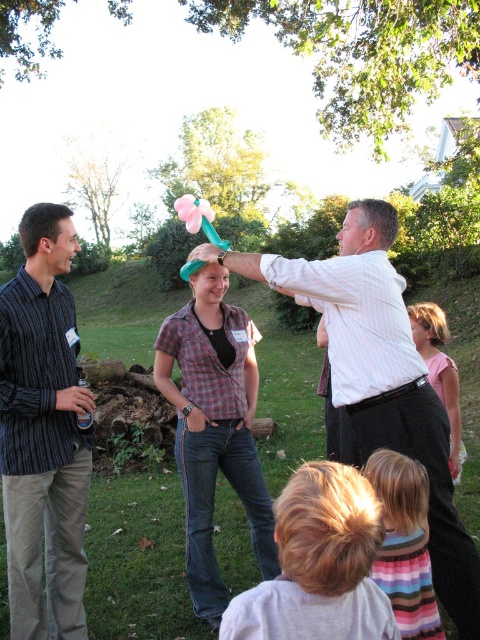
You are a photographer at the event and want to capture a photo that includes both the striped cotton shirt at left and the pink fabric dress at lower right. Which object should be positioned closer to the camera to ensure both are fully visible in the frame?

The striped cotton shirt at left is in front of the pink fabric dress at lower right, so positioning the striped cotton shirt at left closer to the camera will ensure both are fully visible in the frame.

Consider the image. You are organizing a small picnic and need to place a centerpiece between the striped cotton shirt at left and the pink fabric dress at lower right. The centerpiece requires at least 6 feet of space. Can you fit it between them?

The striped cotton shirt at left and pink fabric dress at lower right are 7.02 feet apart from each other, so yes, the centerpiece can be placed between them as the distance is sufficient.